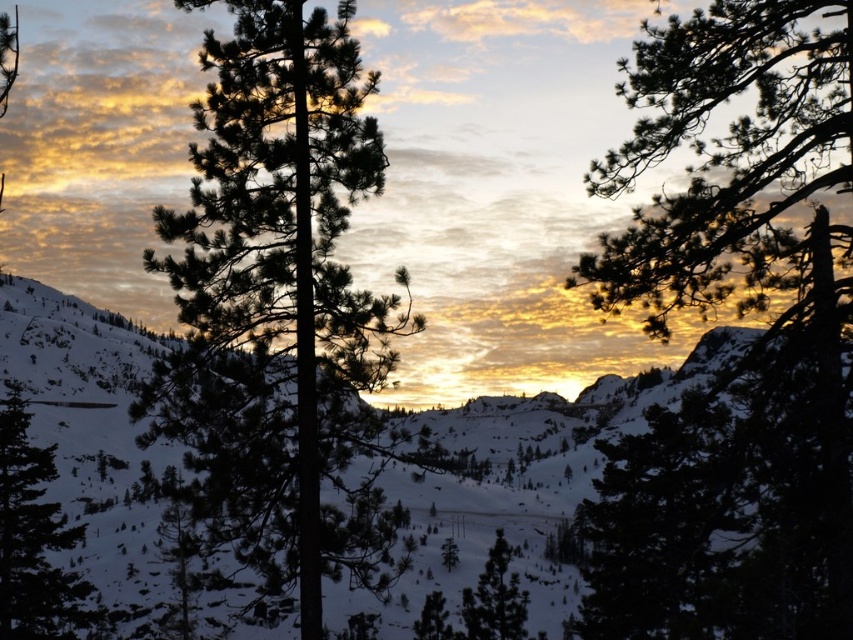
You are standing at the point labeled as point (746, 353) in the winter landscape image. Looking towards the upper right direction, what object would you see in that direction?

The point labeled as point (746, 353) corresponds to the green textured pine tree at upper right, so looking towards the upper right direction from that point, you would see the green textured pine tree at upper right.

You are standing in the winter landscape and want to walk from the green matte tree at center to the green textured pine tree at upper right. Which direction should you head?

You should head to the right because the green textured pine tree at upper right is located to the right of the green matte tree at center.